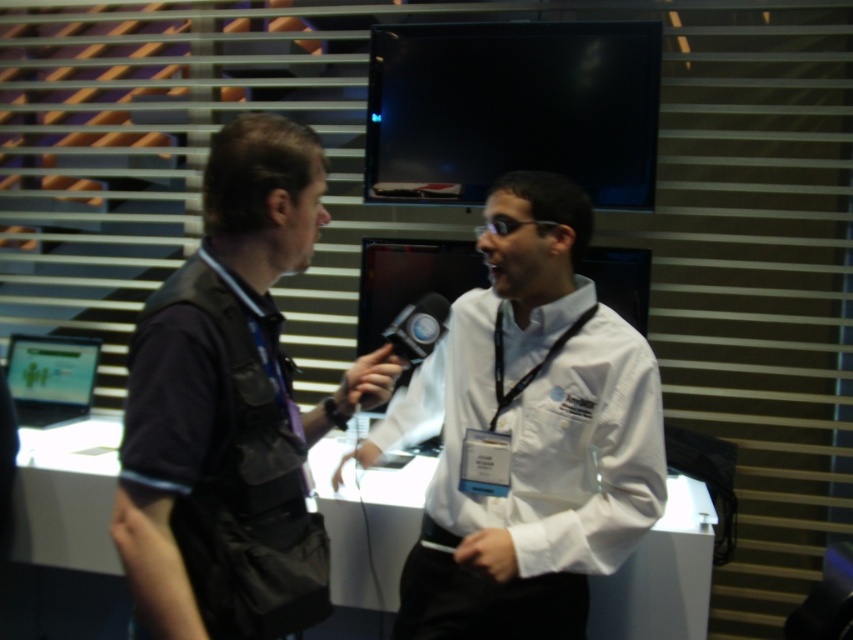
You are a photographer positioned at the origin point. You want to take a photo of the white glossy shirt at center. What are the coordinates where you should aim your camera?

The coordinates to aim the camera are at point (532, 435), which is where the white glossy shirt at center is located.

You are a photographer at a conference and need to capture a photo of both the white glossy shirt at center and the black fabric vest at left. Based on their positions, which one should you focus on first to ensure both are in frame?

The white glossy shirt at center is to the right of the black fabric vest at left, so you should focus on the black fabric vest at left first to ensure both are in frame.